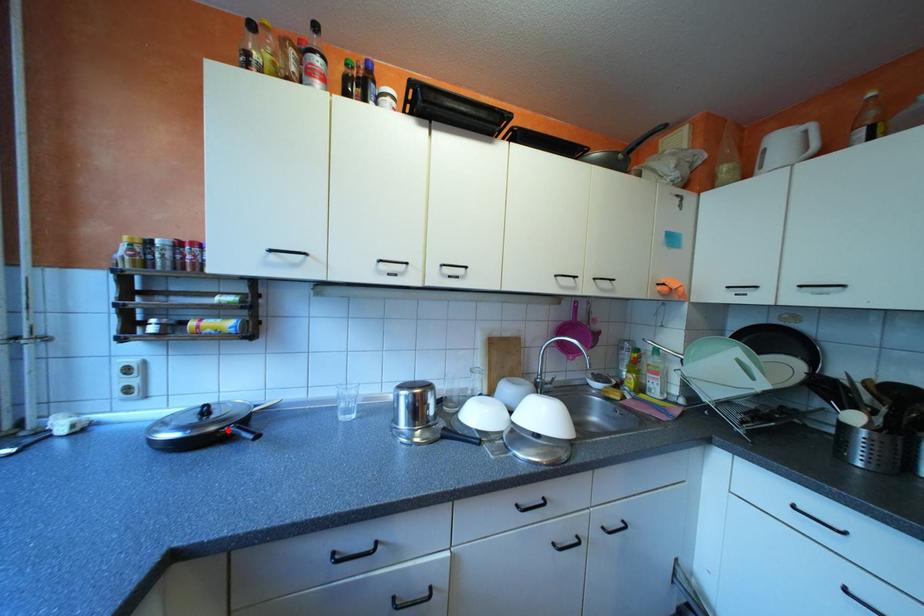
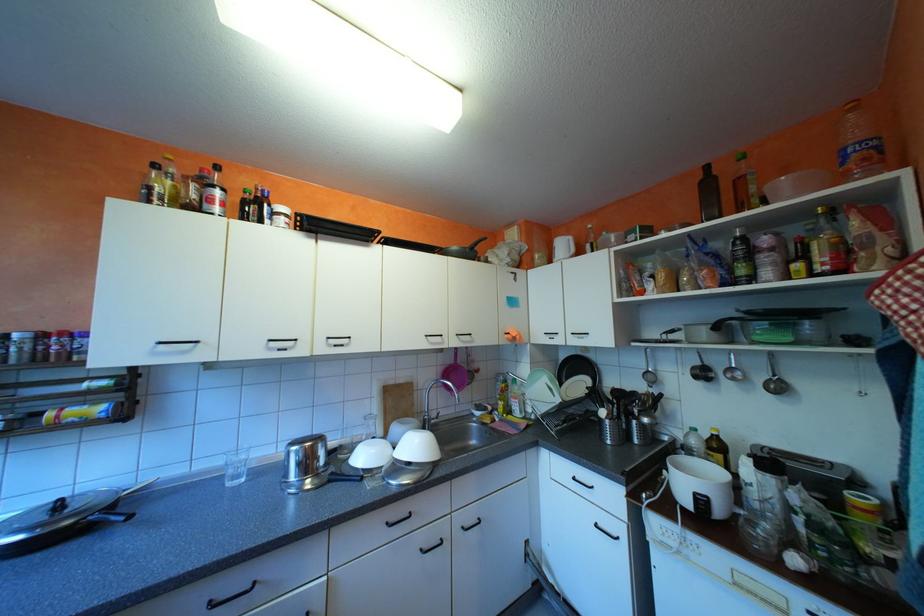
Question: I am providing you with two images of the same scene from different viewpoints. A red point is marked on the first image. Is the red point's position out of view in image 2?

Choices:
 (A) Yes
 (B) No

Answer: (B)